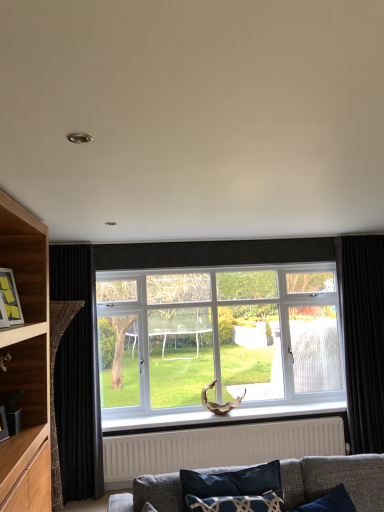
Image resolution: width=384 pixels, height=512 pixels. Find the location of `vacant region above white textured radiator at lower center (from a real-world perspective)`. vacant region above white textured radiator at lower center (from a real-world perspective) is located at coordinates (224, 424).